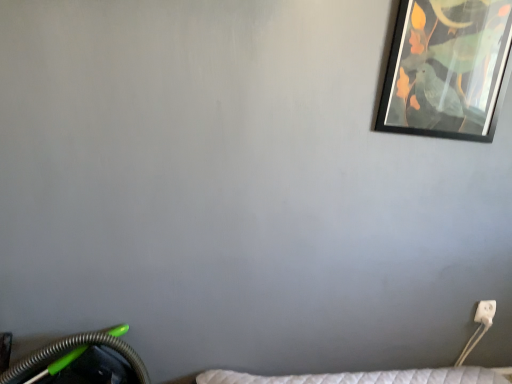
Question: Relative to black matte picture frame at upper right, is white plastic electric outlet at lower right in front or behind?

Choices:
 (A) behind
 (B) front

Answer: (A)

Question: From a real-world perspective, is white plastic electric outlet at lower right above or below black matte picture frame at upper right?

Choices:
 (A) below
 (B) above

Answer: (A)

Question: Based on their positions, is white plastic electric outlet at lower right located to the left or right of black matte picture frame at upper right?

Choices:
 (A) right
 (B) left

Answer: (A)

Question: Is black matte picture frame at upper right spatially inside white plastic electric outlet at lower right, or outside of it?

Choices:
 (A) inside
 (B) outside

Answer: (B)

Question: Visually, is black matte picture frame at upper right positioned to the left or to the right of white plastic electric outlet at lower right?

Choices:
 (A) left
 (B) right

Answer: (A)

Question: From the image's perspective, is black matte picture frame at upper right positioned above or below white plastic electric outlet at lower right?

Choices:
 (A) below
 (B) above

Answer: (B)

Question: From a real-world perspective, relative to white plastic electric outlet at lower right, is black matte picture frame at upper right vertically above or below?

Choices:
 (A) above
 (B) below

Answer: (A)